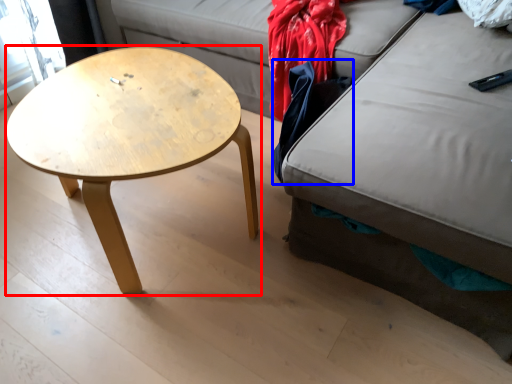
Question: Among these objects, which one is nearest to the camera, coffee table (highlighted by a red box) or clothing (highlighted by a blue box)?

Choices:
 (A) coffee table
 (B) clothing

Answer: (A)